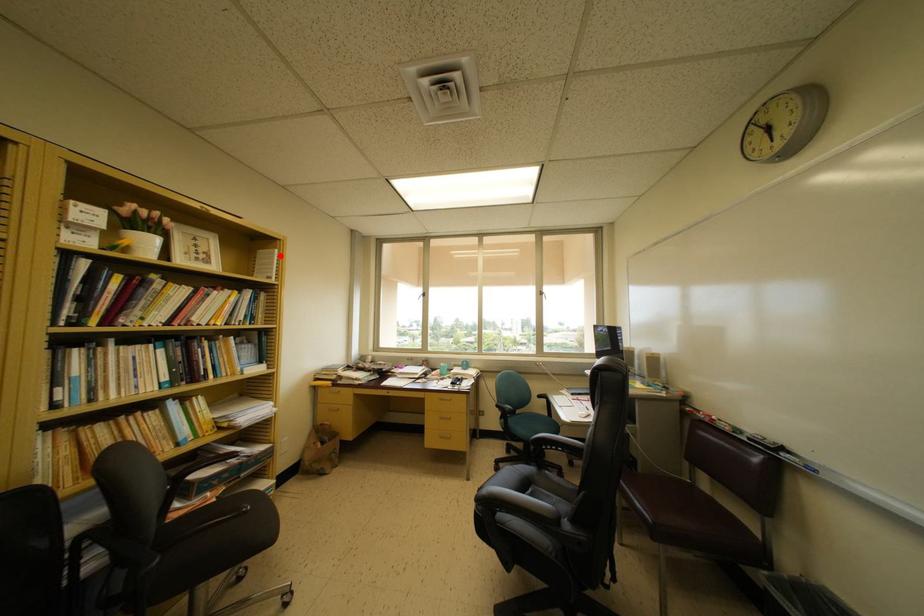
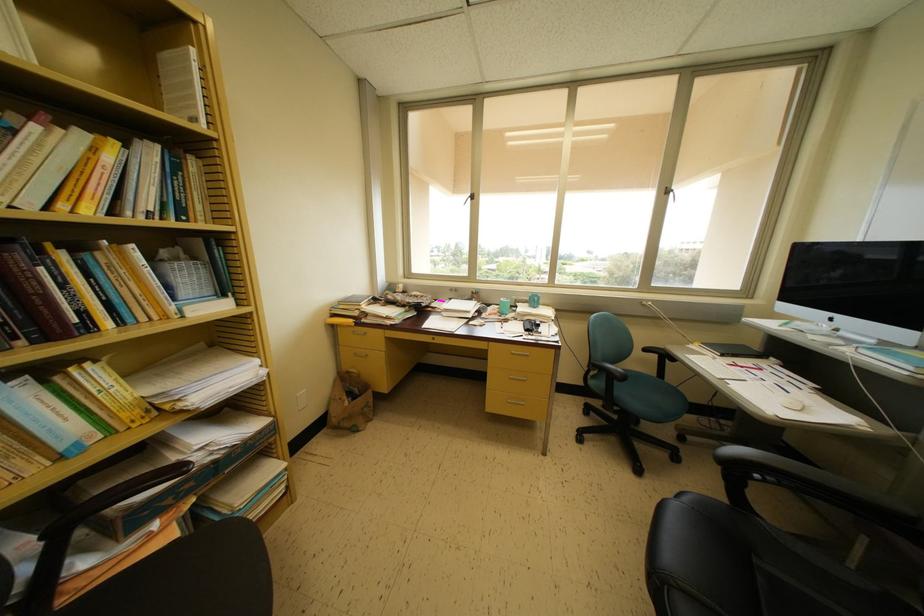
Find the pixel in the second image that matches the highlighted location in the first image.

(197, 55)